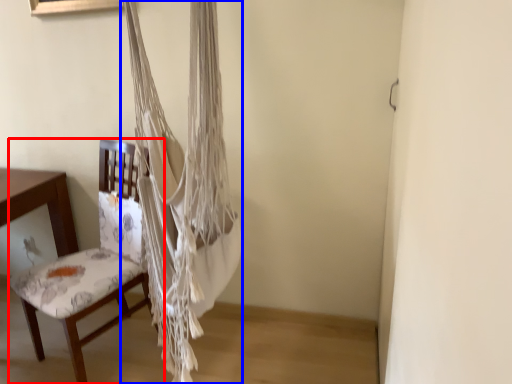
Question: Among these objects, which one is farthest to the camera, chair (highlighted by a red box) or curtain (highlighted by a blue box)?

Choices:
 (A) chair
 (B) curtain

Answer: (A)